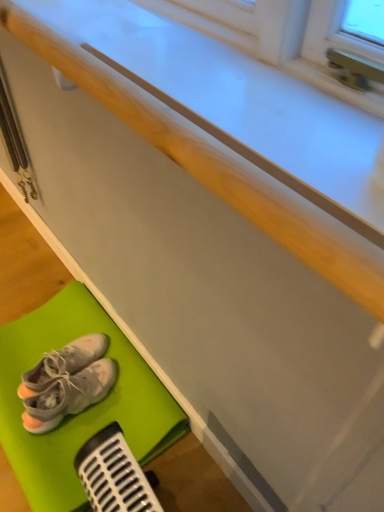
Where is `vacant area that is in front of white fabric sneakers at lower left, placed as the 2th footwear when sorted from bottom to top`? The image size is (384, 512). vacant area that is in front of white fabric sneakers at lower left, placed as the 2th footwear when sorted from bottom to top is located at coordinates (51, 438).